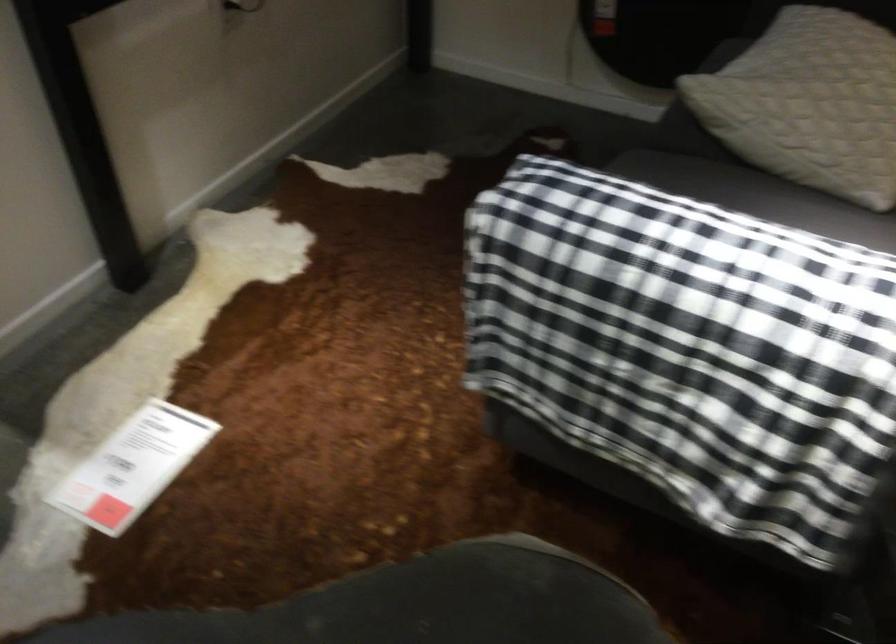
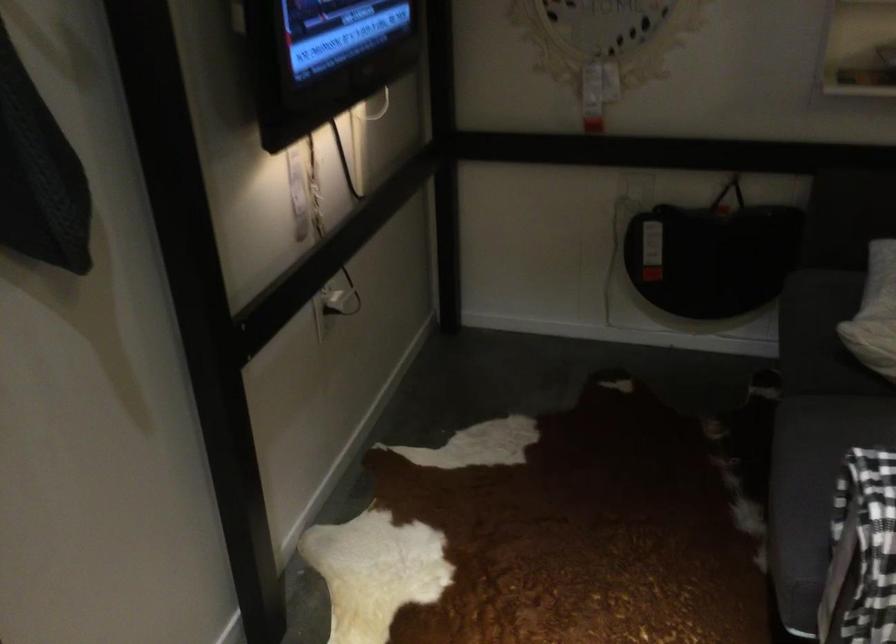
Find the pixel in the second image that matches (726,75) in the first image.

(874, 313)